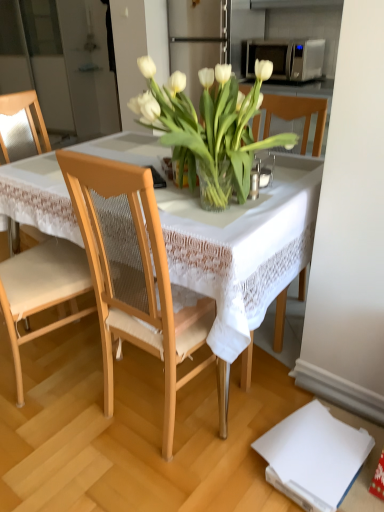
Locate an element on the screen. This screenshot has width=384, height=512. free space to the left of light wood chair at center, which ranks as the second chair in left-to-right order is located at coordinates (77, 421).